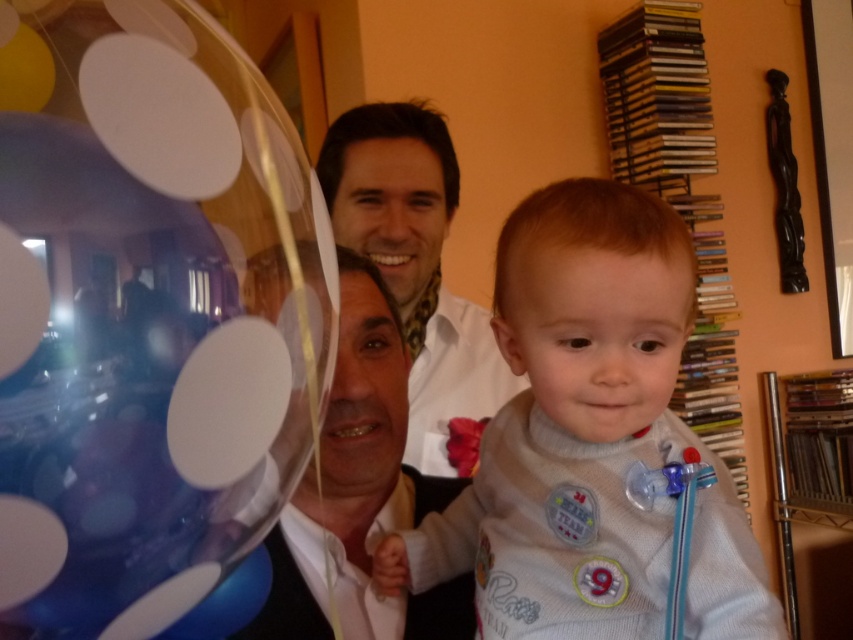
Question: Is transparent plastic balloon at upper left smaller than matte black shirt at center?

Choices:
 (A) yes
 (B) no

Answer: (A)

Question: Can you confirm if white soft baby at center is smaller than matte black shirt at center?

Choices:
 (A) no
 (B) yes

Answer: (A)

Question: Which point is closer to the camera?

Choices:
 (A) white glossy shirt at upper center
 (B) matte black shirt at center

Answer: (B)

Question: Does transparent plastic balloon at upper left appear on the right side of matte black shirt at center?

Choices:
 (A) yes
 (B) no

Answer: (B)

Question: Which object is farther from the camera taking this photo?

Choices:
 (A) transparent plastic balloon at upper left
 (B) matte black shirt at center
 (C) white soft baby at center
 (D) white glossy shirt at upper center

Answer: (D)

Question: Which is nearer to the white soft baby at center?

Choices:
 (A) matte black shirt at center
 (B) transparent plastic balloon at upper left
 (C) white glossy shirt at upper center

Answer: (A)